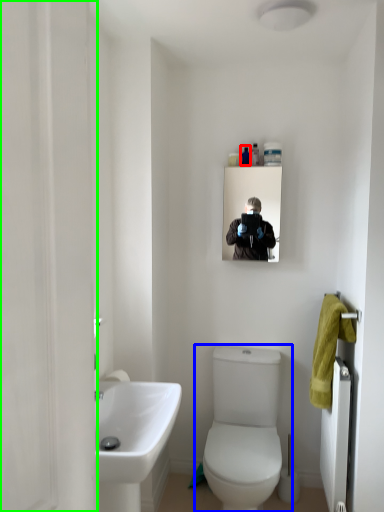
Question: Which object is the farthest from toiletry (highlighted by a red box)? Choose among these: toilet (highlighted by a blue box) or screen door (highlighted by a green box).

Choices:
 (A) toilet
 (B) screen door

Answer: (B)